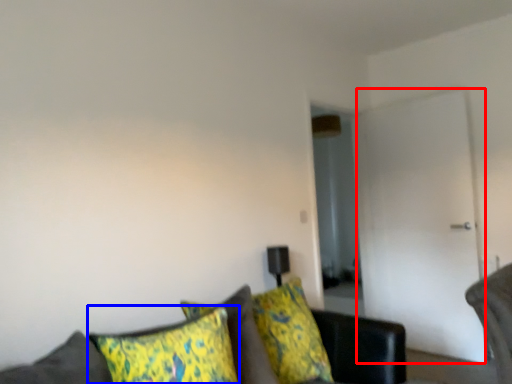
Question: Which of the following is the farthest to the observer, glass door (highlighted by a red box) or pillow (highlighted by a blue box)?

Choices:
 (A) glass door
 (B) pillow

Answer: (A)